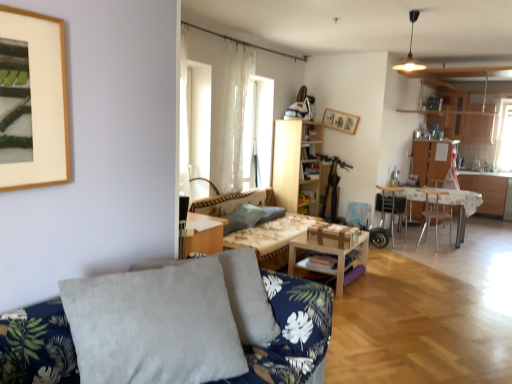
Question: From their relative heights in the image, would you say sheer white curtain at center is taller or shorter than matte gold light fixture at upper center?

Choices:
 (A) short
 (B) tall

Answer: (B)

Question: Does point (236, 153) appear closer or farther from the camera than point (413, 13)?

Choices:
 (A) farther
 (B) closer

Answer: (A)

Question: Estimate the real-world distances between objects in this image. Which object is farther from the light wood bookshelf at center?

Choices:
 (A) matte gold light fixture at upper center
 (B) wooden bookshelf at center
 (C) metallic silver chair at right, the 1th chair when ordered from left to right
 (D) gray fabric pillow at center, acting as the 1th pillow starting from the back
 (E) metallic silver armchair at right

Answer: (A)

Question: Estimate the real-world distances between objects in this image. Which object is closer to the gray velvety pillow at center, the first pillow viewed from the front?

Choices:
 (A) metallic silver armchair at right
 (B) matte gold light fixture at upper center
 (C) metallic silver chair at center, the first chair positioned from the right
 (D) wooden picture frame at upper center
 (E) wooden bookshelf at center

Answer: (E)